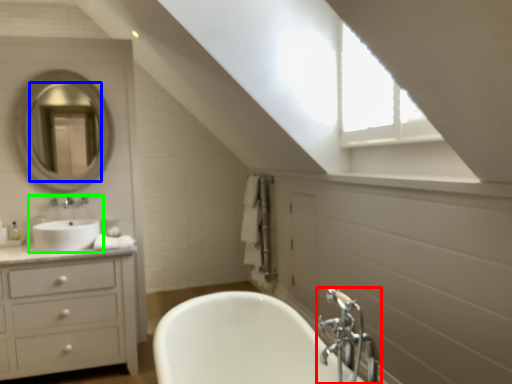
Question: Which object is positioned farthest from tap (highlighted by a red box)? Select from mirror (highlighted by a blue box) and sink (highlighted by a green box).

Choices:
 (A) mirror
 (B) sink

Answer: (A)